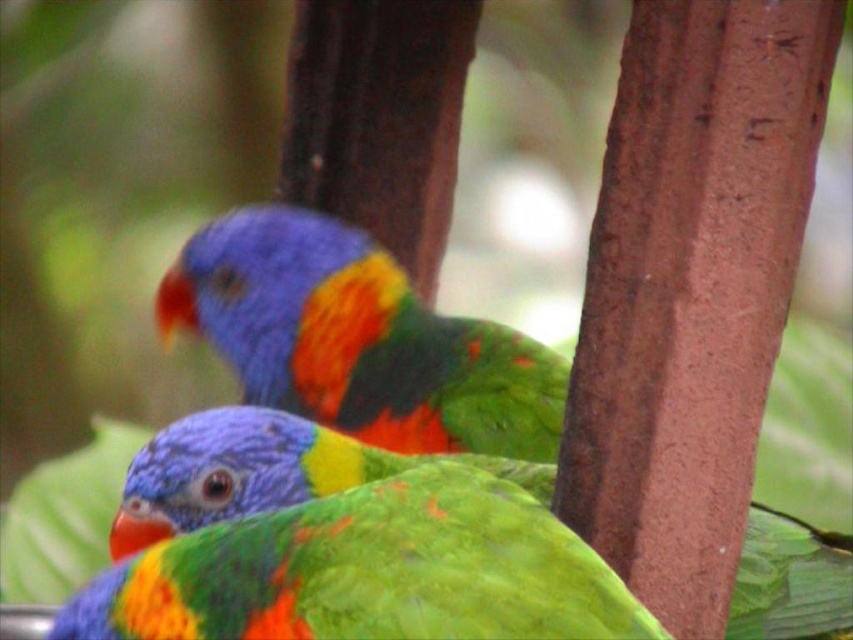
Between shiny multicolored parrot at center and shiny green parrot at center, which one is positioned higher?

shiny multicolored parrot at center

Looking at this image, can you confirm if shiny multicolored parrot at center is positioned below shiny green parrot at center?

Incorrect, shiny multicolored parrot at center is not positioned below shiny green parrot at center.

At what (x,y) coordinates should I click in order to perform the action: click on shiny multicolored parrot at center. Please return your answer as a coordinate pair (x, y). Looking at the image, I should click on (358, 339).